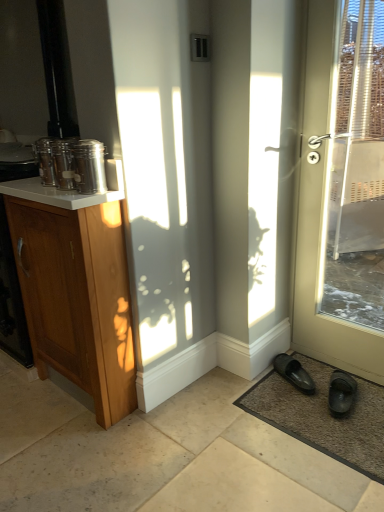
Question: Is white glossy counter top at upper left not close to wooden cabinet at left?

Choices:
 (A) yes
 (B) no

Answer: (B)

Question: Is white glossy counter top at upper left facing away from wooden cabinet at left?

Choices:
 (A) yes
 (B) no

Answer: (B)

Question: From the image's perspective, would you say white glossy counter top at upper left is positioned over wooden cabinet at left?

Choices:
 (A) yes
 (B) no

Answer: (A)

Question: Can you confirm if white glossy counter top at upper left is shorter than wooden cabinet at left?

Choices:
 (A) no
 (B) yes

Answer: (B)

Question: Is the depth of white glossy counter top at upper left less than that of wooden cabinet at left?

Choices:
 (A) yes
 (B) no

Answer: (A)

Question: Which is correct: matte white door at right is inside brown textured mat at lower right, or outside of it?

Choices:
 (A) outside
 (B) inside

Answer: (A)

Question: In terms of width, does matte white door at right look wider or thinner when compared to brown textured mat at lower right?

Choices:
 (A) thin
 (B) wide

Answer: (A)

Question: Does point (301, 313) appear closer or farther from the camera than point (289, 401)?

Choices:
 (A) farther
 (B) closer

Answer: (A)

Question: In the image, is matte white door at right positioned in front of or behind brown textured mat at lower right?

Choices:
 (A) behind
 (B) front

Answer: (B)

Question: Is point (84, 314) closer or farther from the camera than point (56, 205)?

Choices:
 (A) farther
 (B) closer

Answer: (A)

Question: Considering the positions of wooden cabinet at left and white glossy counter top at upper left in the image, is wooden cabinet at left taller or shorter than white glossy counter top at upper left?

Choices:
 (A) tall
 (B) short

Answer: (A)

Question: Is wooden cabinet at left inside or outside of white glossy counter top at upper left?

Choices:
 (A) outside
 (B) inside

Answer: (A)

Question: Based on their positions, is wooden cabinet at left located to the left or right of white glossy counter top at upper left?

Choices:
 (A) right
 (B) left

Answer: (A)

Question: From the image's perspective, is brown textured mat at lower right positioned above or below matte white door at right?

Choices:
 (A) below
 (B) above

Answer: (A)

Question: Considering the positions of brown textured mat at lower right and matte white door at right in the image, is brown textured mat at lower right wider or thinner than matte white door at right?

Choices:
 (A) wide
 (B) thin

Answer: (A)